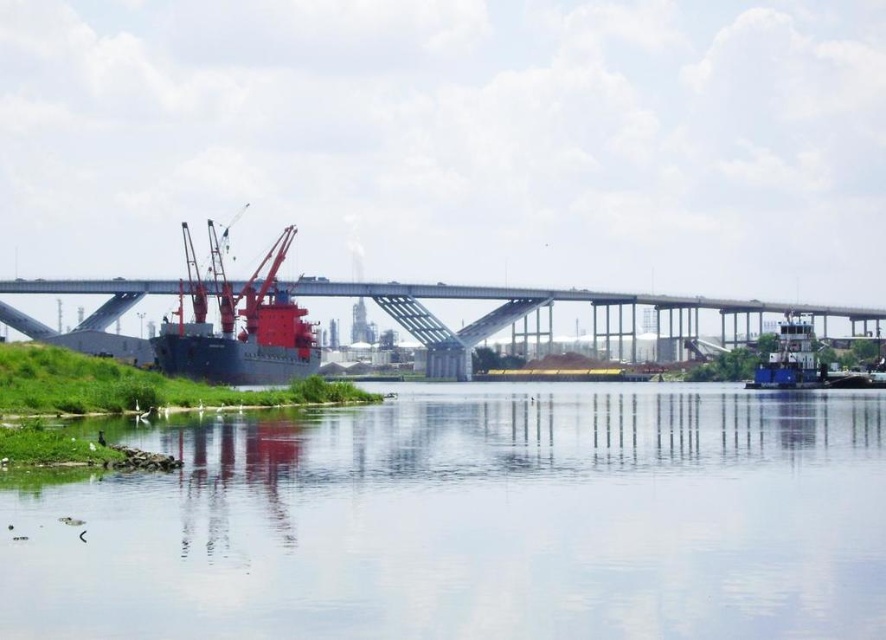
You are standing on the riverbank and want to cross to the other side. There is a point marked at coordinates (473, 522) on clear water at center. Can you safely walk directly to this point?

The point at coordinates (473, 522) is on clear water at center, so it is safe to walk directly to this point as it is on clear water.

You are standing on the riverside path and want to take a photo of the clear water at center and the metallic gray bridge at center. Which object should you position to the left side of your camera frame?

You should position the clear water at center to the left side of your camera frame because it is already located to the left of the metallic gray bridge at center in the image.